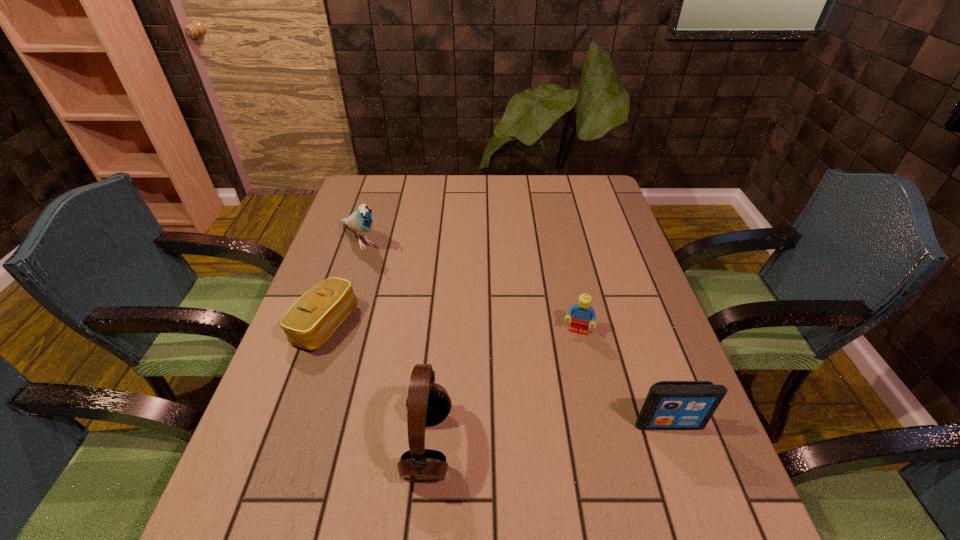
Find the location of a particular element. This screenshot has height=540, width=960. vacant space in between the shortest object and the iPod is located at coordinates (497, 375).

The height and width of the screenshot is (540, 960). Identify the location of free space between the bird and the headset. (395, 342).

Identify the location of unoccupied position between the bird and the rightmost object. The width and height of the screenshot is (960, 540). (515, 332).

Image resolution: width=960 pixels, height=540 pixels. I want to click on free spot between the clutch bag and the second object from right to left, so click(x=451, y=329).

What are the coordinates of `free spot between the bird and the Lego` in the screenshot? It's located at (468, 286).

Locate an element on the screen. free space between the fourth object from left to right and the headset is located at coordinates (503, 389).

I want to click on vacant area between the fourth object from left to right and the clutch bag, so click(x=451, y=329).

Identify which object is the fourth closest to the rightmost object. Please provide its 2D coordinates. Your answer should be formatted as a tuple, i.e. [(x, y)], where the tuple contains the x and y coordinates of a point satisfying the conditions above.

[(360, 221)]

Locate which object is the third closest to the bird. Please provide its 2D coordinates. Your answer should be formatted as a tuple, i.e. [(x, y)], where the tuple contains the x and y coordinates of a point satisfying the conditions above.

[(582, 313)]

In order to click on free spot that satisfies the following two spatial constraints: 1. on the front side of the shortest object; 2. on the ear pads of the headset in this screenshot , I will do `click(283, 446)`.